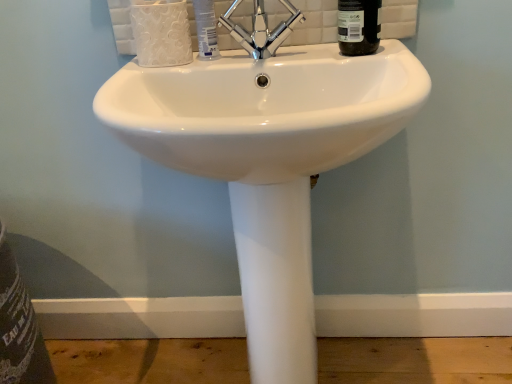
Question: From their relative heights in the image, would you say chrome metallic faucet at center is taller or shorter than white plastic tube at center?

Choices:
 (A) tall
 (B) short

Answer: (A)

Question: Is chrome metallic faucet at center in front of or behind white plastic tube at center in the image?

Choices:
 (A) front
 (B) behind

Answer: (A)

Question: Which is nearer to the chrome metallic faucet at center?

Choices:
 (A) white ceramic sink at center
 (B) white plastic tube at center
 (C) black glass bottle at upper right

Answer: (B)

Question: Which object is positioned closest to the chrome metallic faucet at center?

Choices:
 (A) white plastic tube at center
 (B) black glass bottle at upper right
 (C) white ceramic sink at center

Answer: (A)